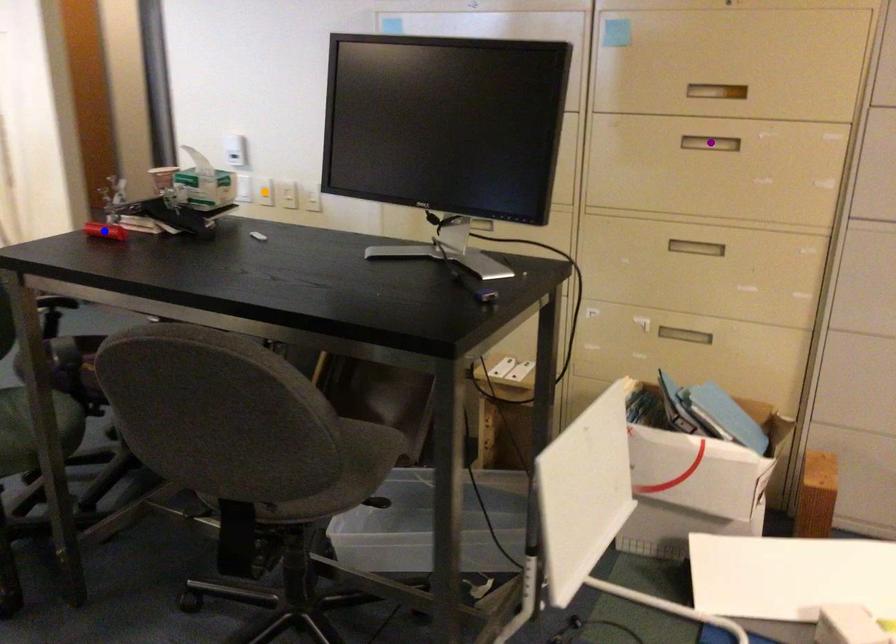
In the scene shown: Order these from nearest to farthest:
purple point
blue point
orange point

orange point → purple point → blue point